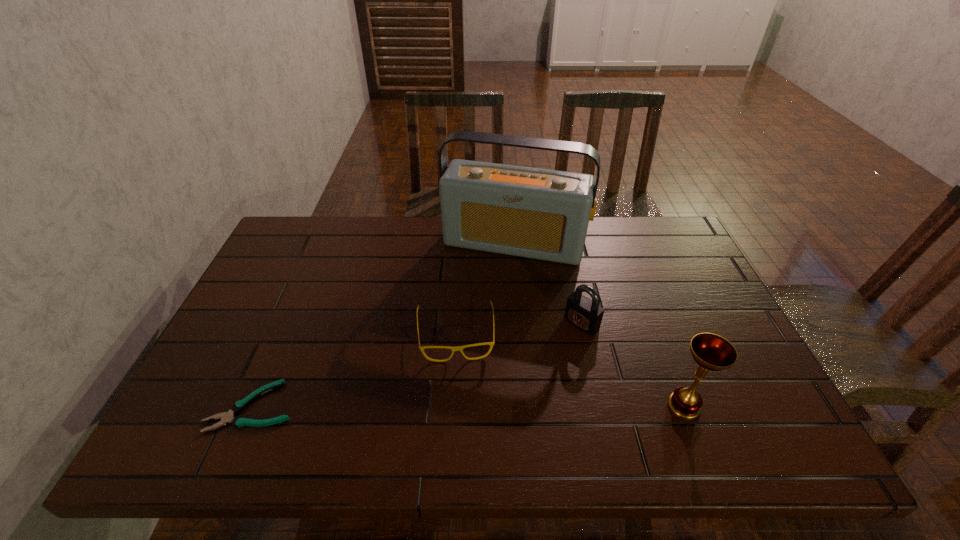
What are the coordinates of `the shortest object` in the screenshot? It's located at [226, 417].

The width and height of the screenshot is (960, 540). I want to click on pliers, so click(x=226, y=417).

At what (x,y) coordinates should I click in order to perform the action: click on the rightmost object. Please return your answer as a coordinate pair (x, y). The width and height of the screenshot is (960, 540). Looking at the image, I should click on (711, 352).

Image resolution: width=960 pixels, height=540 pixels. What are the coordinates of `the fourth shortest object` in the screenshot? It's located at (711, 352).

You are a GUI agent. You are given a task and a screenshot of the screen. Output one action in this format:
    pyautogui.click(x=<x>, y=<y>)
    Task: Click on the radio receiver
    This screenshot has height=540, width=960.
    Given the screenshot: What is the action you would take?
    pyautogui.click(x=543, y=214)

Where is `the tallest object`? the tallest object is located at coordinates (543, 214).

You are a GUI agent. You are given a task and a screenshot of the screen. Output one action in this format:
    pyautogui.click(x=<x>, y=<y>)
    Task: Click on the second shortest object
    The width and height of the screenshot is (960, 540).
    Given the screenshot: What is the action you would take?
    pyautogui.click(x=454, y=348)

Find the location of `the third tallest object`. the third tallest object is located at coordinates (585, 314).

Where is `blank area located 0.330m on the back of the shortest object`? blank area located 0.330m on the back of the shortest object is located at coordinates (304, 286).

Where is `free space located 0.210m on the left of the fourth shortest object`? free space located 0.210m on the left of the fourth shortest object is located at coordinates (571, 406).